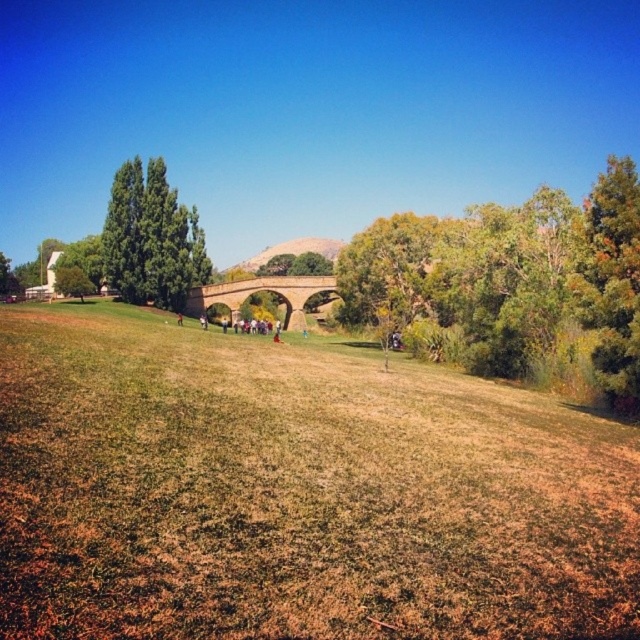
Is brown dry grass at center to the left of green leafy tree at center from the viewer's perspective?

Yes, brown dry grass at center is to the left of green leafy tree at center.

Which is in front, point (433, 624) or point (346, 259)?

Point (433, 624)

Locate an element on the screen. The image size is (640, 640). brown dry grass at center is located at coordinates (296, 492).

Is green leafy tree at center below green leafy tree at left?

No, green leafy tree at center is not below green leafy tree at left.

Looking at this image, who is more forward, (472,298) or (157,282)?

Point (472,298) is more forward.

Where is `green leafy tree at center`? This screenshot has height=640, width=640. green leafy tree at center is located at coordinates (513, 278).

Consider the image. Is brown dry grass at center bigger than brown stone bridge at center?

Indeed, brown dry grass at center has a larger size compared to brown stone bridge at center.

Is brown dry grass at center to the right of brown stone bridge at center from the viewer's perspective?

Correct, you'll find brown dry grass at center to the right of brown stone bridge at center.

Between point (262, 401) and point (285, 288), which one is positioned in front?

Point (262, 401) is more forward.

Locate an element on the screen. The image size is (640, 640). brown dry grass at center is located at coordinates (296, 492).